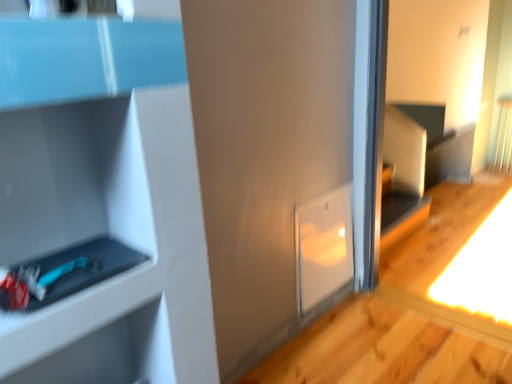
Describe the element at coordinates (323, 246) in the screenshot. I see `white glossy cabinet at center` at that location.

Find the location of a particular element. white glossy cabinet at center is located at coordinates (323, 246).

Find the location of `white glossy cabinet at center`. white glossy cabinet at center is located at coordinates (323, 246).